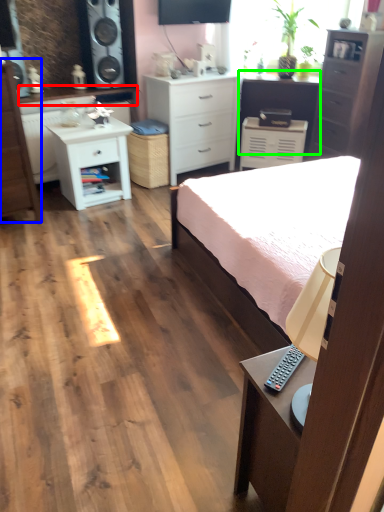
Question: Which object is positioned closest to counter top (highlighted by a red box)? Select from chest of drawers (highlighted by a blue box) and vanity (highlighted by a green box).

Choices:
 (A) chest of drawers
 (B) vanity

Answer: (A)